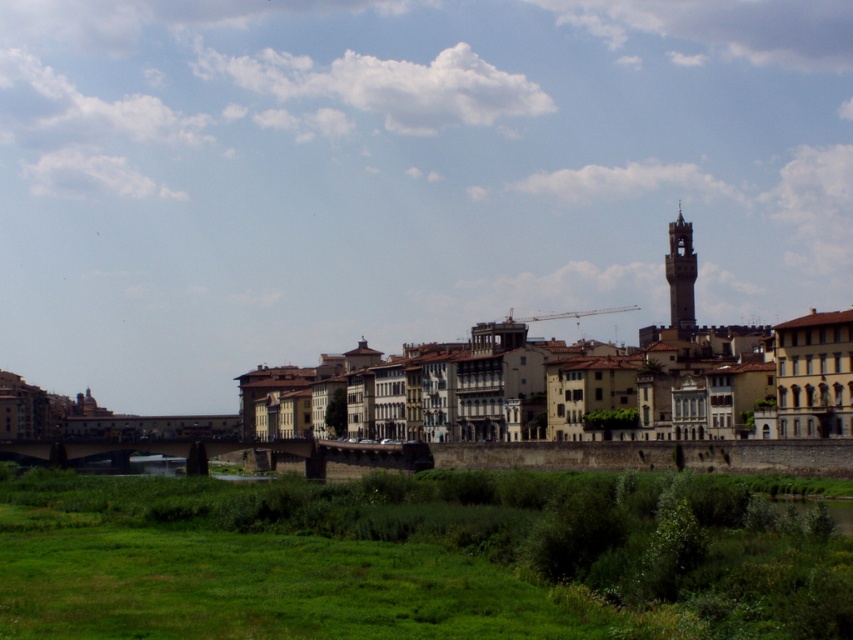
Between point (347, 541) and point (665, 272), which one is positioned behind?

The point (665, 272) is more distant.

Is green grassy at lower center taller than dark gray stone clock tower at upper right?

No.

Which is in front, point (405, 529) or point (682, 326)?

Point (405, 529) is more forward.

Identify the location of green grassy at lower center. (410, 557).

Does point (222, 452) lie behind point (695, 272)?

No.

You are a GUI agent. You are given a task and a screenshot of the screen. Output one action in this format:
    pyautogui.click(x=<x>, y=<y>)
    Task: Click on the concrete bridge at center
    
    Given the screenshot: What is the action you would take?
    pyautogui.click(x=241, y=449)

This screenshot has width=853, height=640. Identify the location of concrete bridge at center. (241, 449).

Which of these two, green grassy at lower center or yellow stone buildings at center, stands taller?

Standing taller between the two is yellow stone buildings at center.

Between point (173, 541) and point (54, 404), which one is positioned in front?

Point (173, 541) is in front.

Locate an element on the screen. This screenshot has height=640, width=853. green grassy at lower center is located at coordinates (x=410, y=557).